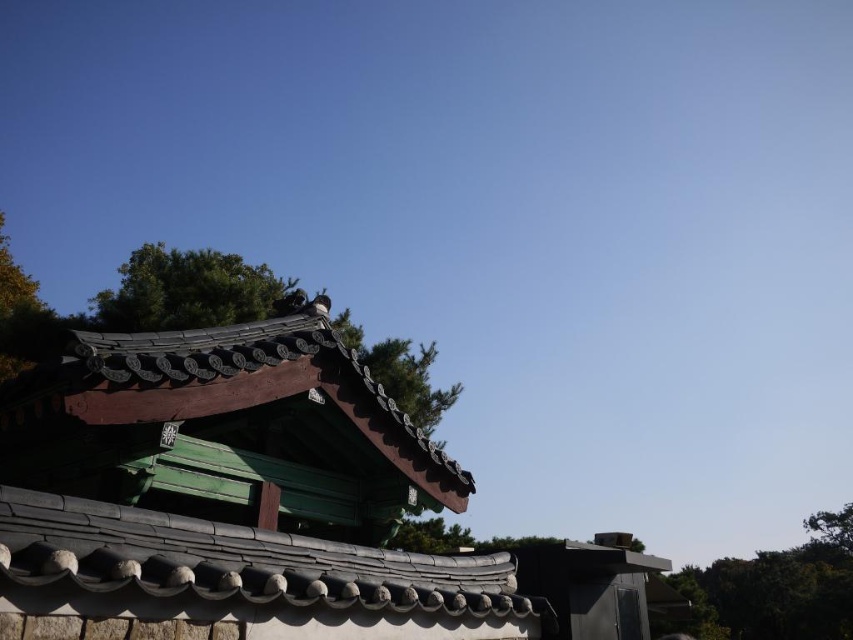
You are a drone operator who needs to fly a drone from the shiny dark green roof at left to the green leafy tree at upper left. The drone has a maximum flight range of 150 feet. Based on the scene, can the drone safely complete the flight without needing to recharge?

The distance between the shiny dark green roof at left and the green leafy tree at upper left is 137.22 feet, which is within the drone operator drone has a maximum flight range of 150 feet. Therefore, the drone can safely complete the flight without needing to recharge.

You are standing in front of the pavilion and notice the shiny dark green roof at left and the green textured tree at center. Which object is shorter in height?

The shiny dark green roof at left is not as tall as the green textured tree at center, so the shiny dark green roof at left is shorter in height.